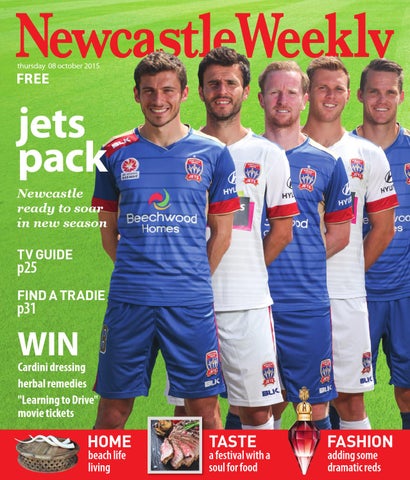
Where is `perfume bottle`? Image resolution: width=410 pixels, height=480 pixels. perfume bottle is located at coordinates (309, 440).